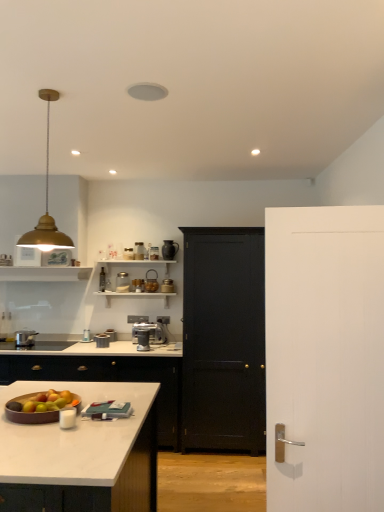
Question: From the image's perspective, is gold metallic pendant light at upper left below metallic silver toaster at upper center, arranged as the first appliance when viewed from the left?

Choices:
 (A) no
 (B) yes

Answer: (A)

Question: Is gold metallic pendant light at upper left placed right next to metallic silver toaster at upper center, arranged as the first appliance when viewed from the left?

Choices:
 (A) yes
 (B) no

Answer: (B)

Question: Can we say gold metallic pendant light at upper left lies outside metallic silver toaster at upper center, arranged as the first appliance when viewed from the left?

Choices:
 (A) yes
 (B) no

Answer: (A)

Question: Does gold metallic pendant light at upper left have a larger size compared to metallic silver toaster at upper center, positioned as the 8th appliance in right-to-left order?

Choices:
 (A) yes
 (B) no

Answer: (A)

Question: Can you confirm if gold metallic pendant light at upper left is smaller than metallic silver toaster at upper center, arranged as the first appliance when viewed from the left?

Choices:
 (A) yes
 (B) no

Answer: (B)

Question: Is metallic silver toaster at center, the 4th appliance viewed from the right, bigger or smaller than white wood door at right, which ranks as the second door in back-to-front order?

Choices:
 (A) small
 (B) big

Answer: (A)

Question: Is metallic silver toaster at center, the 5th appliance viewed from the left, inside the boundaries of white wood door at right, which ranks as the second door in back-to-front order, or outside?

Choices:
 (A) inside
 (B) outside

Answer: (B)

Question: Is metallic silver toaster at center, the 5th appliance viewed from the left, wider or thinner than white wood door at right, which ranks as the second door in back-to-front order?

Choices:
 (A) wide
 (B) thin

Answer: (A)

Question: From the image's perspective, is metallic silver toaster at center, the 5th appliance viewed from the left, positioned above or below white wood door at right, which ranks as the second door in back-to-front order?

Choices:
 (A) below
 (B) above

Answer: (B)

Question: Is black wooden door at center, which is counted as the second door, starting from the front, wider or thinner than metallic glass jar at upper center, acting as the sixth appliance starting from the left?

Choices:
 (A) wide
 (B) thin

Answer: (A)

Question: From a real-world perspective, is black wooden door at center, marked as the 1th door in a back-to-front arrangement, positioned above or below metallic glass jar at upper center, acting as the sixth appliance starting from the left?

Choices:
 (A) above
 (B) below

Answer: (B)

Question: In terms of size, does black wooden door at center, marked as the 1th door in a back-to-front arrangement, appear bigger or smaller than metallic glass jar at upper center, which ranks as the 3th appliance in right-to-left order?

Choices:
 (A) big
 (B) small

Answer: (A)

Question: Considering the positions of black wooden door at center, which is counted as the second door, starting from the front, and metallic glass jar at upper center, acting as the sixth appliance starting from the left, in the image, is black wooden door at center, which is counted as the second door, starting from the front, taller or shorter than metallic glass jar at upper center, acting as the sixth appliance starting from the left,?

Choices:
 (A) tall
 (B) short

Answer: (A)

Question: Would you say metallic silver canister at center, which is the 2th appliance in left-to-right order, is inside or outside metallic silver canister at upper center, which is the 2th appliance in right-to-left order?

Choices:
 (A) outside
 (B) inside

Answer: (A)

Question: Is metallic silver canister at center, which is the 2th appliance in left-to-right order, to the left or to the right of metallic silver canister at upper center, the 7th appliance when ordered from left to right, in the image?

Choices:
 (A) right
 (B) left

Answer: (B)